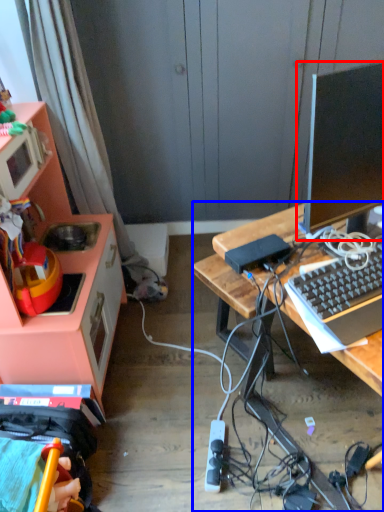
Question: Among these objects, which one is nearest to the camera, television (highlighted by a red box) or desk (highlighted by a blue box)?

Choices:
 (A) television
 (B) desk

Answer: (A)